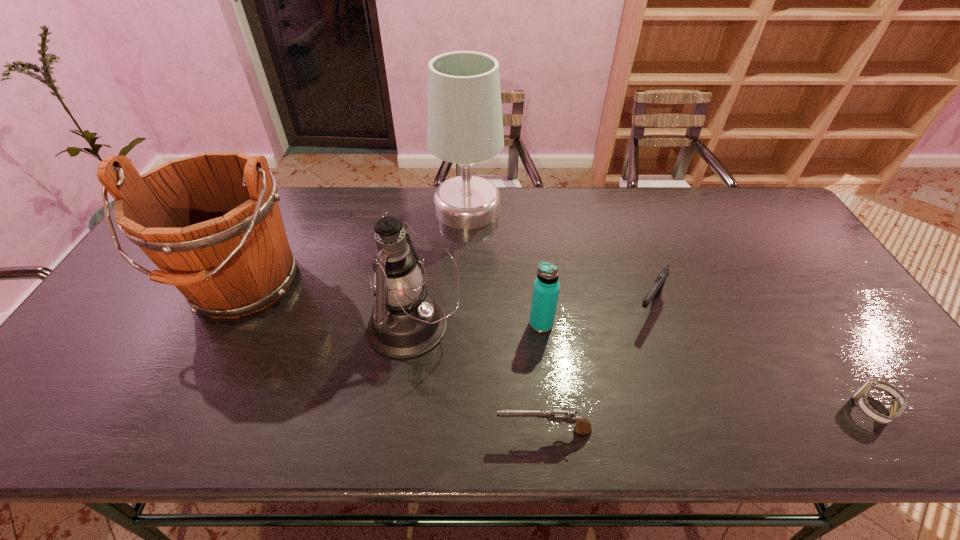
Identify the location of the farthest object. This screenshot has height=540, width=960. (465, 126).

The width and height of the screenshot is (960, 540). What are the coordinates of `lampshade` in the screenshot? It's located at (465, 126).

Locate an element on the screen. The image size is (960, 540). the leftmost object is located at coordinates (211, 223).

The height and width of the screenshot is (540, 960). In order to click on oil lamp in this screenshot , I will do `click(405, 322)`.

Find the location of `water bottle`. water bottle is located at coordinates (546, 288).

You are a GUI agent. You are given a task and a screenshot of the screen. Output one action in this format:
    pyautogui.click(x=<x>, y=<y>)
    Task: Click on the taller gun
    
    Given the screenshot: What is the action you would take?
    pyautogui.click(x=657, y=287)

This screenshot has height=540, width=960. What are the coordinates of `the sixth object from left to right` in the screenshot? It's located at (657, 287).

Locate an element on the screen. Image resolution: width=960 pixels, height=540 pixels. the left gun is located at coordinates (583, 426).

Find the location of a particular element. The image size is (960, 540). the shorter gun is located at coordinates (583, 426).

This screenshot has width=960, height=540. In order to click on the shortest object in this screenshot , I will do `click(897, 406)`.